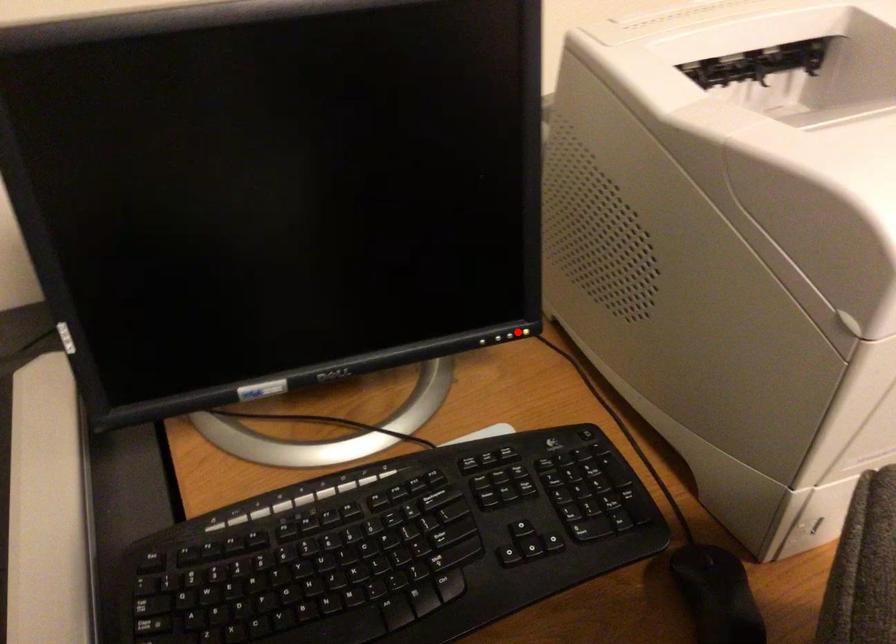
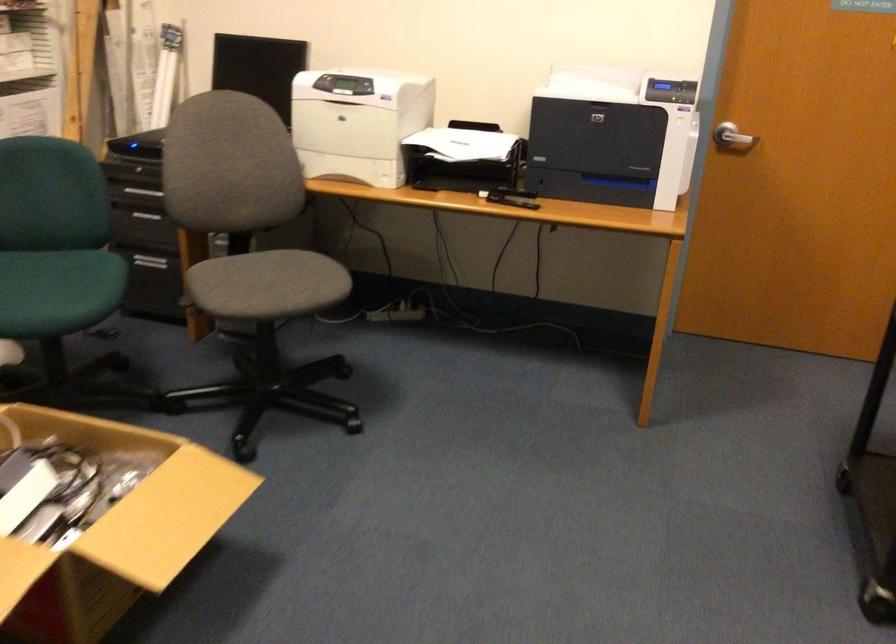
Question: I am providing you with two images of the same scene from different viewpoints. A red point is marked on the first image. Can you still see the location of the red point in image 2?

Choices:
 (A) Yes
 (B) No

Answer: (B)